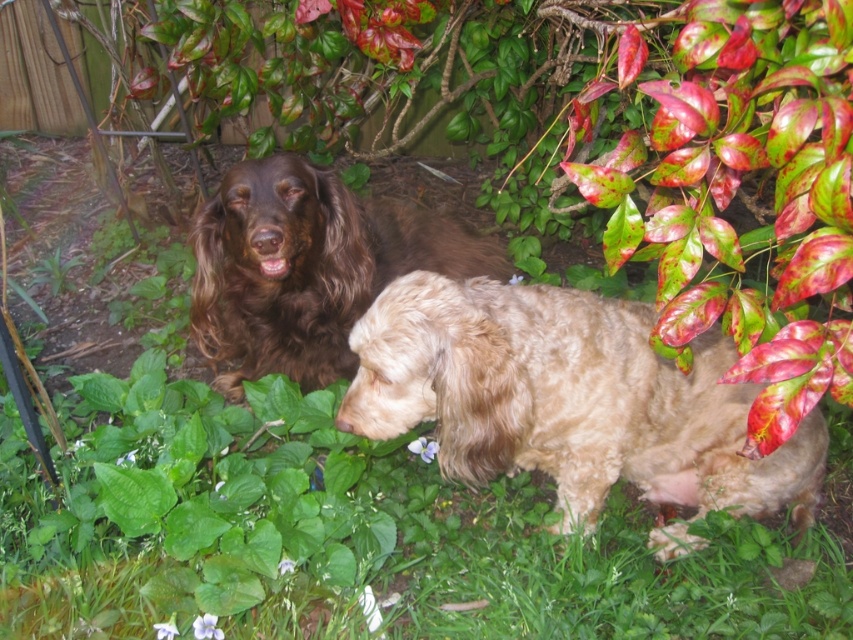
You are a photographer trying to capture both the light brown fur at center and the brown fluffy dog at center in a single shot. Based on their sizes in the image, which one should you focus on to ensure both are visible without zooming in or out?

The light brown fur at center occupies less space than the brown fluffy dog at center, so you should focus on the brown fluffy dog at center to ensure both are visible without needing to adjust the zoom.

Please provide the coordinates of the light brown fur at center in the image. The coordinates should be in the format of a tuple with two decimal numbers rounded to three decimal places, like this example format, e.g., 0.123, 0.456. Please strictly follow the format and do not add any extra text or explanation. The answer must be in the following JSON format. The key is the object label and the value is the coordinates in a tuple. For example, if the object is called apple, the JSON should be like this. The

The coordinates of the light brown fur at center are at point (569, 397).